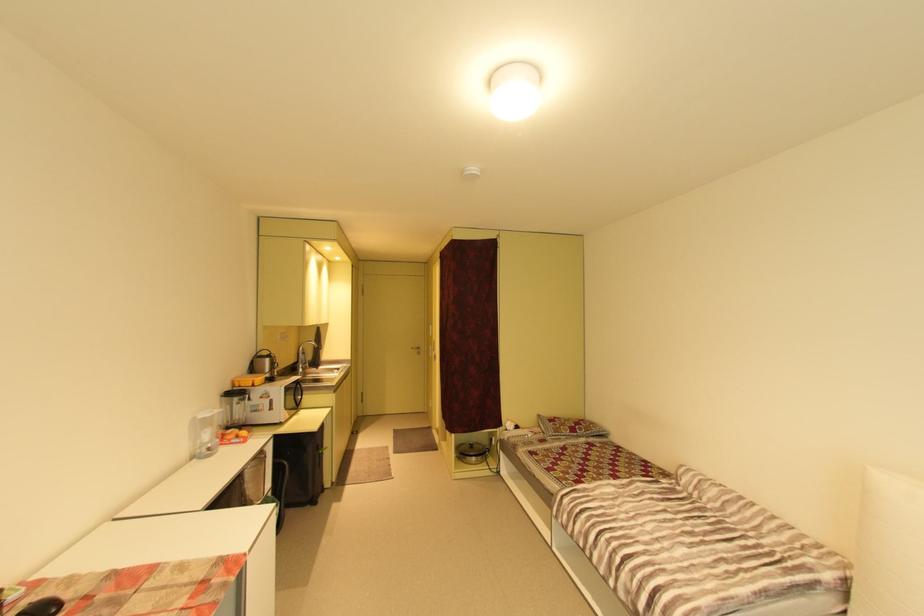
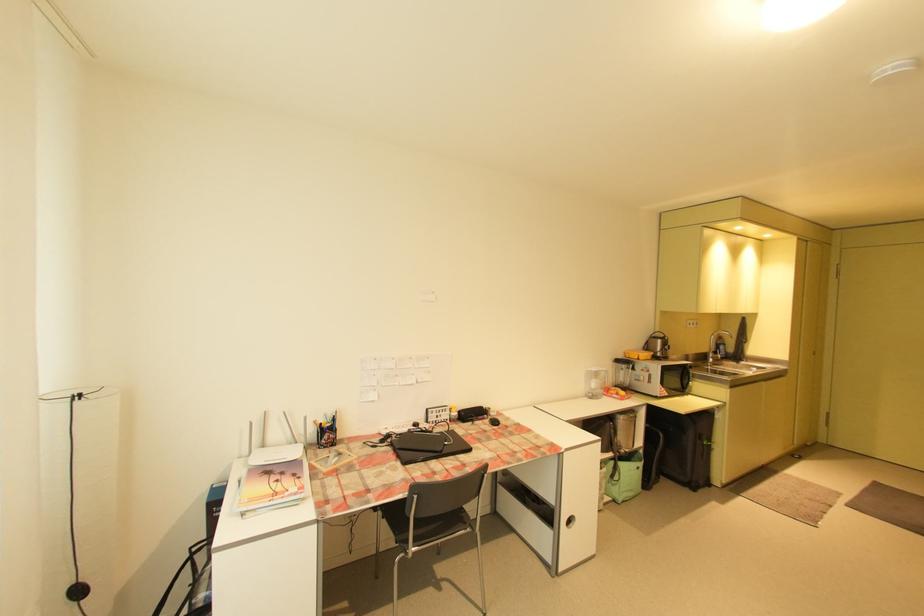
The point at [244,482] is marked in the first image. Where is the corresponding point in the second image?

(614, 424)